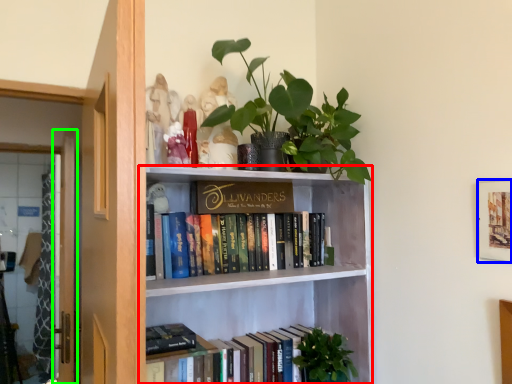
Question: Which object is the farthest from bookcase (highlighted by a red box)? Choose among these: picture frame (highlighted by a blue box) or screen door (highlighted by a green box).

Choices:
 (A) picture frame
 (B) screen door

Answer: (B)